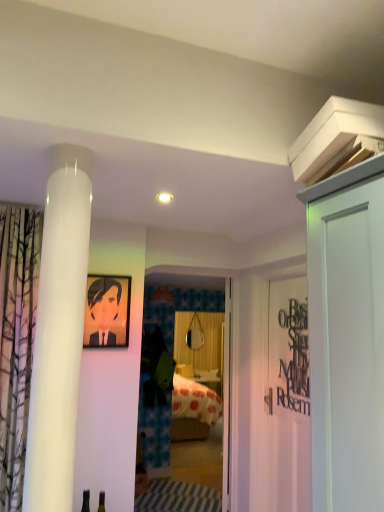
Question: Which is correct: black matte sign at right is inside transparent glass door at center, or outside of it?

Choices:
 (A) inside
 (B) outside

Answer: (B)

Question: From the image's perspective, is black matte sign at right above or below transparent glass door at center?

Choices:
 (A) below
 (B) above

Answer: (B)

Question: Considering the real-world distances, which object is closest to the transparent glass door at center?

Choices:
 (A) white matte door at upper right, the first door when ordered from right to left
 (B) matte black picture frame at upper left
 (C) black matte sign at right
 (D) white glossy door at center, which appears as the 1th door when viewed from the back

Answer: (D)

Question: Which of these objects is positioned farthest from the black matte sign at right?

Choices:
 (A) matte black picture frame at upper left
 (B) white glossy door at center, which is the 2th door from front to back
 (C) white matte door at upper right, the first door when ordered from right to left
 (D) transparent glass door at center

Answer: (D)